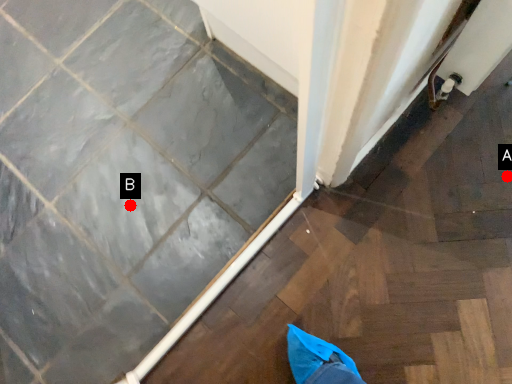
Question: Two points are circled on the image, labeled by A and B beside each circle. Which point appears closest to the camera in this image?

Choices:
 (A) A is closer
 (B) B is closer

Answer: (A)